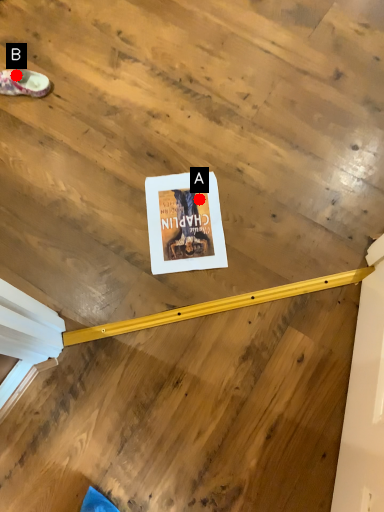
Question: Two points are circled on the image, labeled by A and B beside each circle. Among these points, which one is nearest to the camera?

Choices:
 (A) A is closer
 (B) B is closer

Answer: (A)